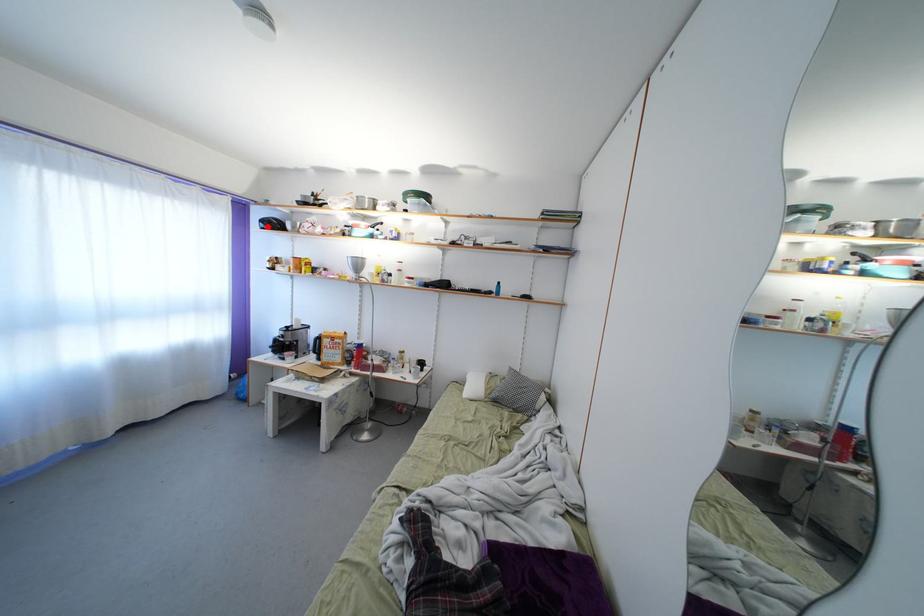
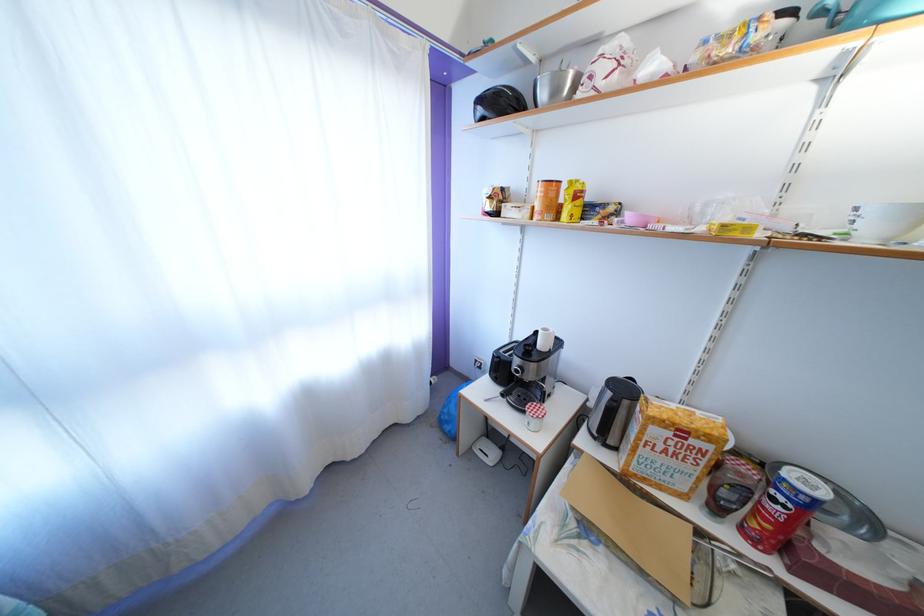
The point at the highlighted location is marked in the first image. Where is the corresponding point in the second image?

(484, 107)